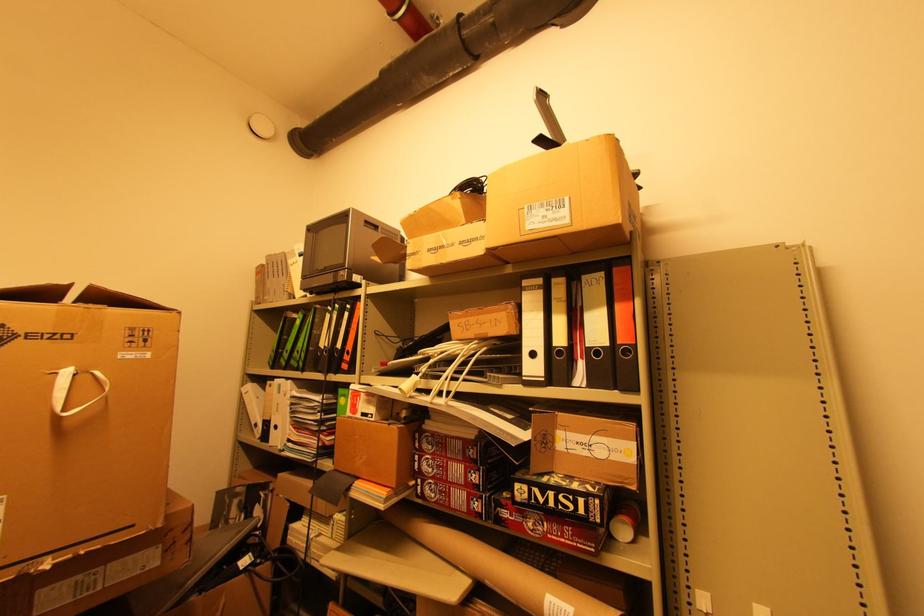
Which object does [554,511] point to?

This point indicates the small product box.